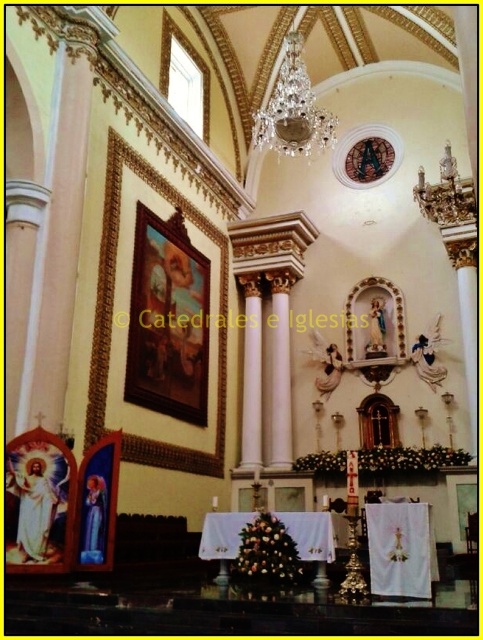
Looking at this image, is wooden framed painting at upper left smaller than crystal glass chandelier at upper center?

Correct, wooden framed painting at upper left occupies less space than crystal glass chandelier at upper center.

Who is taller, wooden framed painting at upper left or crystal glass chandelier at upper center?

With more height is wooden framed painting at upper left.

Locate an element on the screen. wooden framed painting at upper left is located at coordinates (168, 321).